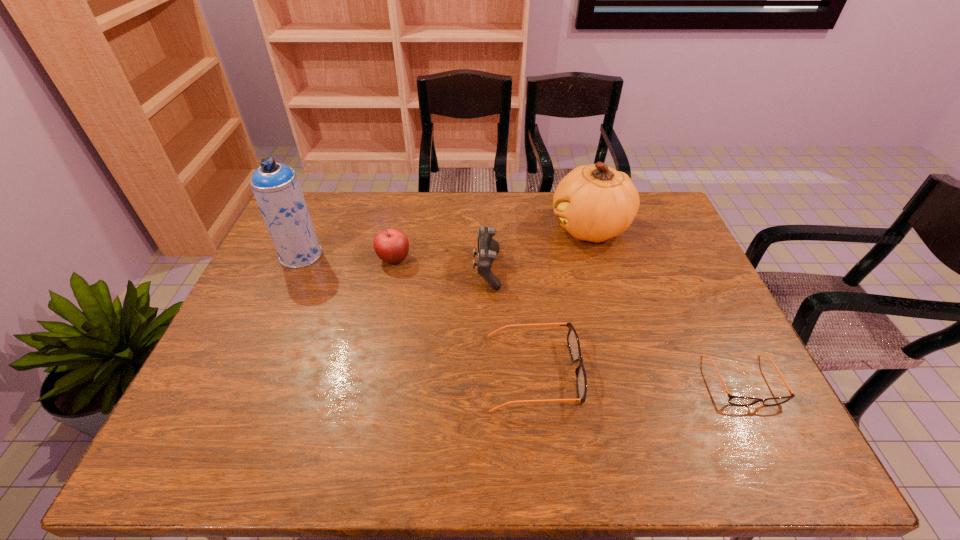
The width and height of the screenshot is (960, 540). In order to click on free spot that satisfies the following two spatial constraints: 1. on the front face of the pumpkin; 2. on the front side of the apple in this screenshot , I will do `click(599, 259)`.